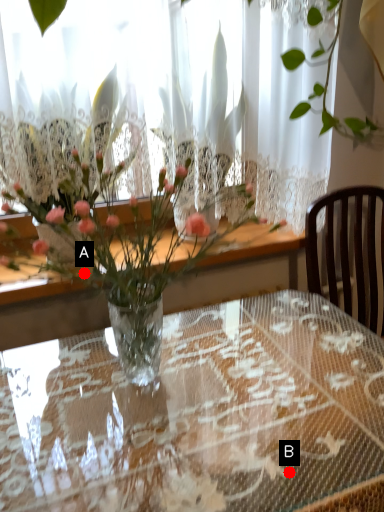
Question: Two points are circled on the image, labeled by A and B beside each circle. Among these points, which one is nearest to the camera?

Choices:
 (A) A is closer
 (B) B is closer

Answer: (B)